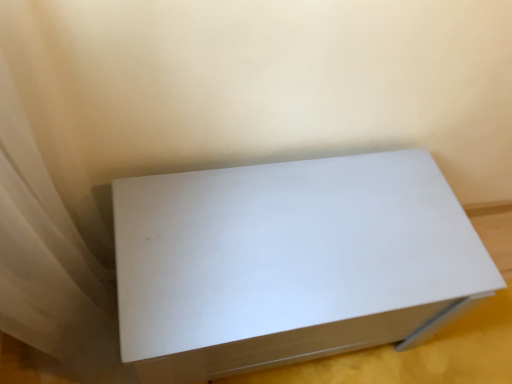
What do you see at coordinates (288, 262) in the screenshot?
I see `white matte box at center` at bounding box center [288, 262].

At what (x,y) coordinates should I click in order to perform the action: click on white matte box at center. Please return your answer as a coordinate pair (x, y). Looking at the image, I should click on click(x=288, y=262).

Where is `white matte box at center`? The image size is (512, 384). white matte box at center is located at coordinates (288, 262).